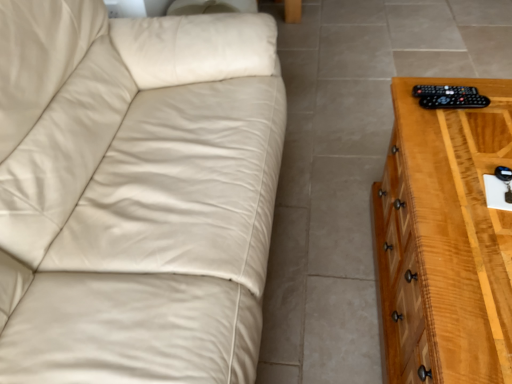
Locate an element on the screen. vacant space positioned to the left of black plastic remote at right is located at coordinates (413, 123).